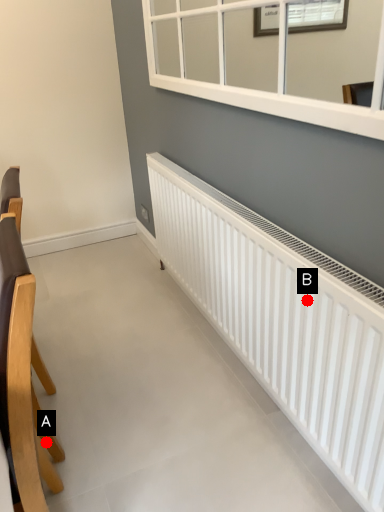
Question: Two points are circled on the image, labeled by A and B beside each circle. Which point appears closest to the camera in this image?

Choices:
 (A) A is closer
 (B) B is closer

Answer: (B)